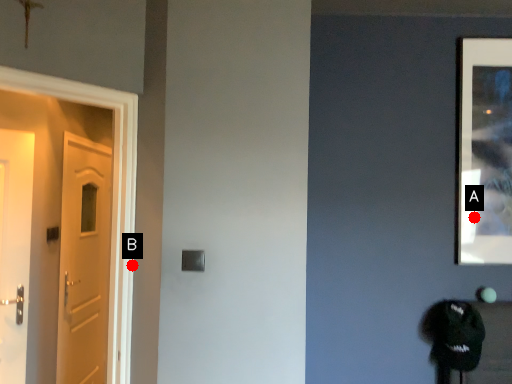
Question: Two points are circled on the image, labeled by A and B beside each circle. Which point appears farthest from the camera in this image?

Choices:
 (A) A is further
 (B) B is further

Answer: (A)